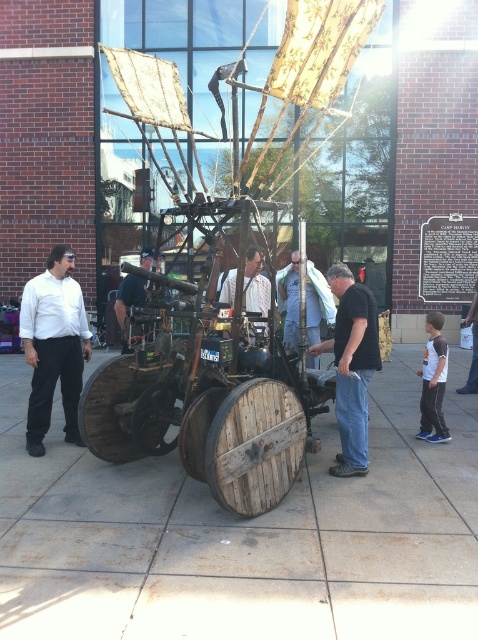
Question: Which point is farther from the camera taking this photo?

Choices:
 (A) (133, 108)
 (B) (49, 444)
 (C) (251, 253)

Answer: (C)

Question: Does wooden cart at center appear on the right side of black leather jacket at center?

Choices:
 (A) no
 (B) yes

Answer: (B)

Question: Which object appears farthest from the camera in this image?

Choices:
 (A) wooden planks at center
 (B) black cotton shirt at center
 (C) dark gray t-shirt at center
 (D) wooden barrel at center

Answer: (C)

Question: Which object appears farthest from the camera in this image?

Choices:
 (A) black cotton shirt at center
 (B) wooden cart at center
 (C) matte white shirt at left

Answer: (C)

Question: Can you confirm if wooden planks at center is positioned to the left of wooden barrel at center?

Choices:
 (A) yes
 (B) no

Answer: (B)

Question: Considering the relative positions of wooden planks at center and black cotton shirt at center in the image provided, where is wooden planks at center located with respect to black cotton shirt at center?

Choices:
 (A) below
 (B) above

Answer: (A)